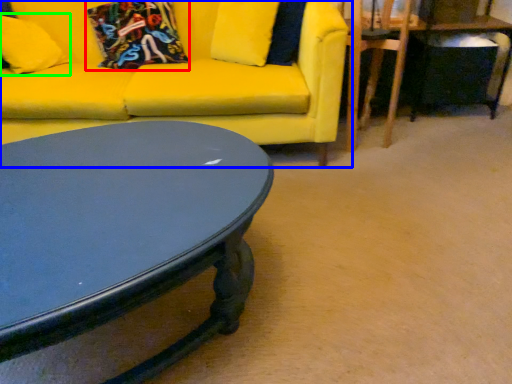
Question: Considering the real-world distances, which object is farthest from pillow (highlighted by a red box)? studio couch (highlighted by a blue box) or pillow (highlighted by a green box)?

Choices:
 (A) studio couch
 (B) pillow

Answer: (B)